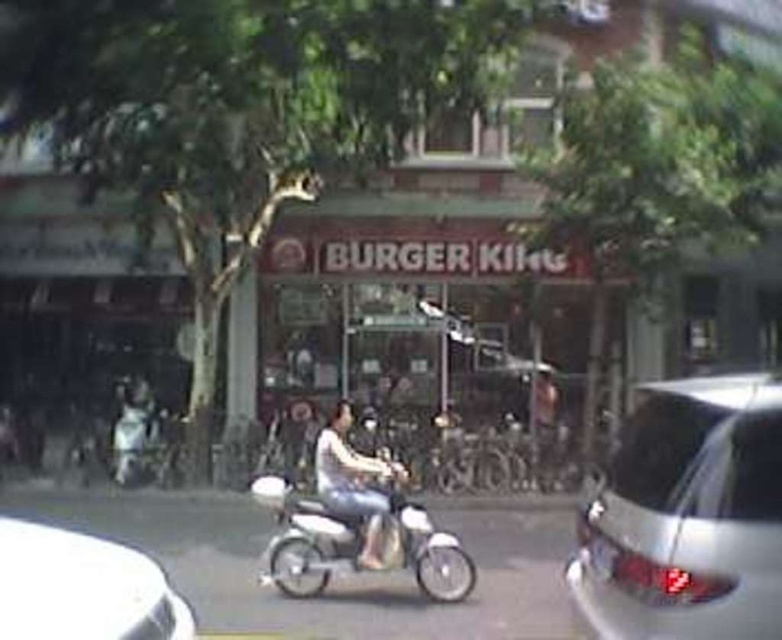
Question: Which object is farther from the camera taking this photo?

Choices:
 (A) light brown leather jacket at center
 (B) shiny silver car at right
 (C) white glossy car at lower left
 (D) metallic silver motorcycle at center

Answer: (A)

Question: Is white glossy car at lower left positioned at the back of light brown leather jacket at center?

Choices:
 (A) yes
 (B) no

Answer: (B)

Question: Which object is positioned closest to the shiny silver car at right?

Choices:
 (A) light brown leather jacket at center
 (B) white glossy car at lower left
 (C) metallic silver motorcycle at center

Answer: (B)

Question: Based on their relative distances, which object is nearer to the light brown leather jacket at center?

Choices:
 (A) shiny silver car at right
 (B) metallic silver motorcycle at center
 (C) white glossy car at lower left

Answer: (B)

Question: Can you confirm if shiny silver car at right is positioned above metallic silver motorcycle at center?

Choices:
 (A) no
 (B) yes

Answer: (B)

Question: Is shiny silver car at right above light brown leather jacket at center?

Choices:
 (A) yes
 (B) no

Answer: (A)